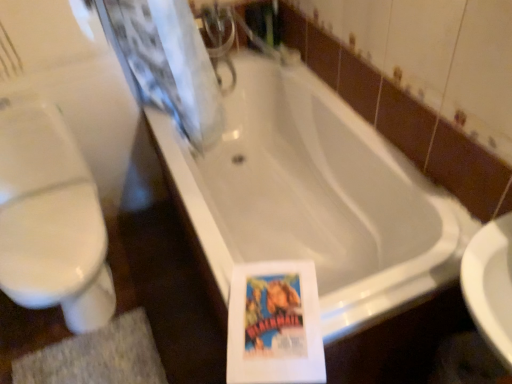
Question: From a real-world perspective, is white glossy bathtub at center above or below white glossy toilet at left?

Choices:
 (A) above
 (B) below

Answer: (B)

Question: Is white glossy bathtub at center inside the boundaries of white glossy toilet at left, or outside?

Choices:
 (A) inside
 (B) outside

Answer: (B)

Question: Which of these objects is positioned closest to the gray textured bath mat at lower left?

Choices:
 (A) white glossy toilet at left
 (B) white glossy bathtub at center

Answer: (A)

Question: Estimate the real-world distances between objects in this image. Which object is farther from the white glossy bathtub at center?

Choices:
 (A) white glossy toilet at left
 (B) gray textured bath mat at lower left

Answer: (B)